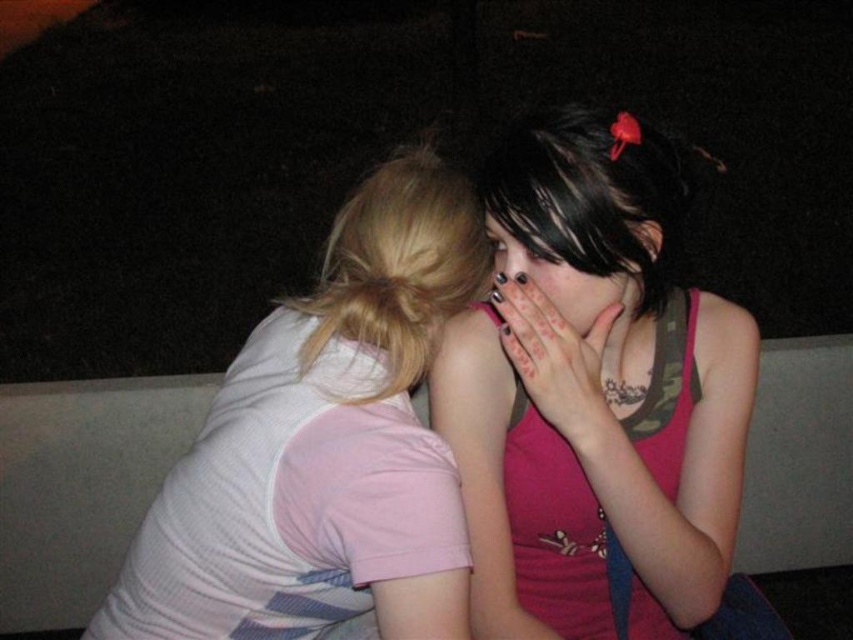
Question: Which object is positioned closest to the dark matte hand at center?

Choices:
 (A) white striped shirt at left
 (B) matte black hair at center
 (C) pink fabric tank top at center

Answer: (B)

Question: Which object is farther from the camera taking this photo?

Choices:
 (A) matte black hair at center
 (B) pink fabric tank top at center
 (C) white striped shirt at left
 (D) dark matte hand at center

Answer: (D)

Question: Which point appears closest to the camera in this image?

Choices:
 (A) (701, 369)
 (B) (575, 378)
 (C) (384, 376)

Answer: (C)

Question: Where is white striped shirt at left located in relation to dark matte hand at center in the image?

Choices:
 (A) right
 (B) left

Answer: (B)

Question: Is dark matte hand at center to the right of matte black hair at center from the viewer's perspective?

Choices:
 (A) yes
 (B) no

Answer: (B)

Question: Does pink fabric tank top at center come in front of dark matte hand at center?

Choices:
 (A) no
 (B) yes

Answer: (B)